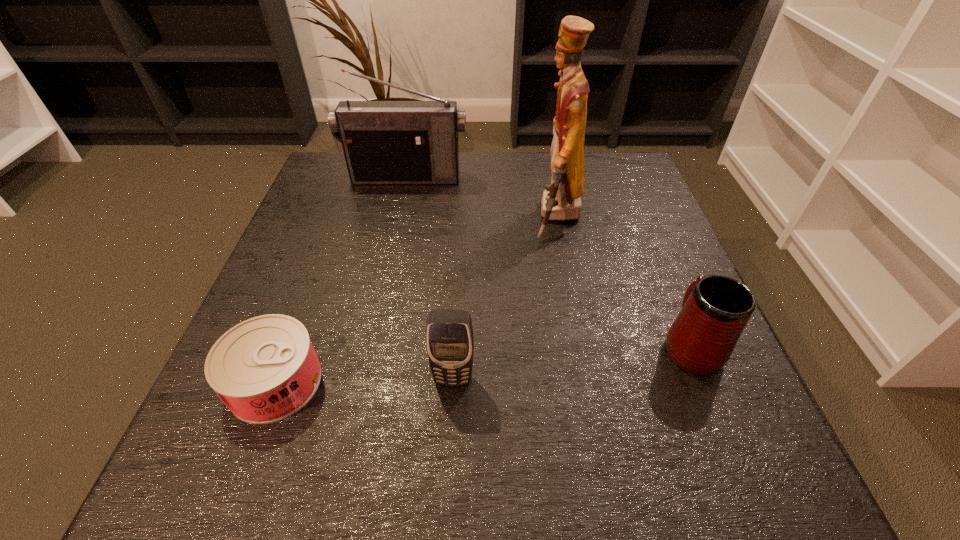
At what (x,y) coordinates should I click in order to perform the action: click on vacant area that lies between the shortest object and the cellular telephone. Please return your answer as a coordinate pair (x, y). The width and height of the screenshot is (960, 540). Looking at the image, I should click on (364, 381).

I want to click on free spot between the shortest object and the rightmost object, so click(x=483, y=363).

I want to click on empty space that is in between the can and the radio receiver, so tap(341, 280).

Image resolution: width=960 pixels, height=540 pixels. Identify the location of empty space between the cellular telephone and the mug. (571, 362).

Identify the location of blank region between the farthest object and the fourth nearest object. point(482,198).

This screenshot has width=960, height=540. Identify the location of free area in between the can and the mug. (483, 363).

Where is `free spot between the tallest object and the shortest object`? The height and width of the screenshot is (540, 960). free spot between the tallest object and the shortest object is located at coordinates (417, 299).

The image size is (960, 540). What are the coordinates of `empty space between the cellular telephone and the can` in the screenshot? It's located at (364, 381).

Select which object is the third closest to the mug. Please provide its 2D coordinates. Your answer should be formatted as a tuple, i.e. [(x, y)], where the tuple contains the x and y coordinates of a point satisfying the conditions above.

[(384, 142)]

Identify which object is located as the second nearest to the cellular telephone. Please provide its 2D coordinates. Your answer should be formatted as a tuple, i.e. [(x, y)], where the tuple contains the x and y coordinates of a point satisfying the conditions above.

[(715, 310)]